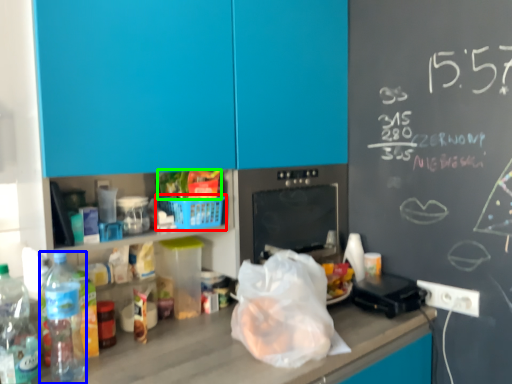
Question: Based on their relative distances, which object is nearer to basket (highlighted by a red box)? Choose from bottle (highlighted by a blue box) and food (highlighted by a green box).

Choices:
 (A) bottle
 (B) food

Answer: (B)